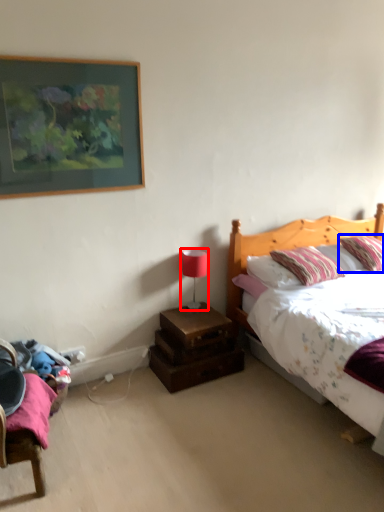
Question: Which of the following is the farthest to the observer, table lamp (highlighted by a red box) or pillow (highlighted by a blue box)?

Choices:
 (A) table lamp
 (B) pillow

Answer: (B)